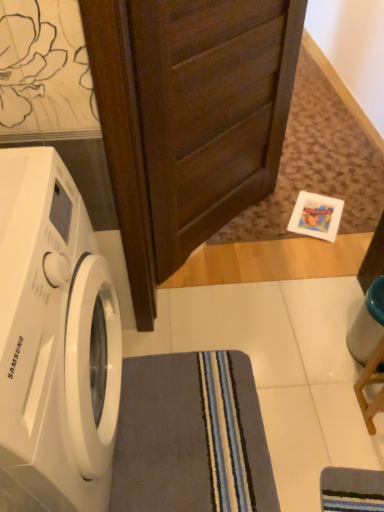
Find the location of `gray soft rug at lower center`. gray soft rug at lower center is located at coordinates (191, 436).

This screenshot has width=384, height=512. Identify the location of dark wood screen door at upper center. (210, 110).

Between gray soft rug at lower center and white glossy washing machine at left, which one appears on the left side from the viewer's perspective?

From the viewer's perspective, white glossy washing machine at left appears more on the left side.

Can you tell me how much gray soft rug at lower center and white glossy washing machine at left differ in facing direction?

The angular difference between gray soft rug at lower center and white glossy washing machine at left is 4.14 degrees.

Can you confirm if gray soft rug at lower center is taller than white glossy washing machine at left?

No, gray soft rug at lower center is not taller than white glossy washing machine at left.

Does point (194, 380) lie behind point (32, 282)?

Yes, point (194, 380) is farther from viewer.

Is gray soft rug at lower center inside or outside of dark wood screen door at upper center?

gray soft rug at lower center lies outside dark wood screen door at upper center.

Is point (155, 426) more distant than point (174, 122)?

Yes, it is.

How distant is gray soft rug at lower center from dark wood screen door at upper center?

A distance of 29.31 inches exists between gray soft rug at lower center and dark wood screen door at upper center.

Is the depth of gray soft rug at lower center greater than that of dark wood screen door at upper center?

Yes, gray soft rug at lower center is further from the camera.

At what (x,y) coordinates should I click in order to perform the action: click on bath towel beneath the white glossy washing machine at left (from a real-world perspective). Please return your answer as a coordinate pair (x, y). This screenshot has height=512, width=384. Looking at the image, I should click on (191, 436).

Is white glossy washing machine at left positioned with its back to gray soft rug at lower center?

No, white glossy washing machine at left's orientation is not away from gray soft rug at lower center.

Based on the photo, from a real-world perspective, is white glossy washing machine at left positioned above or below gray soft rug at lower center?

Clearly, from a real-world perspective, white glossy washing machine at left is above gray soft rug at lower center.

How many degrees apart are the facing directions of white glossy washing machine at left and gray soft rug at lower center?

4.14 degrees.

Does point (68, 492) lie behind point (194, 48)?

That is False.

Can you see white glossy washing machine at left touching dark wood screen door at upper center?

No, white glossy washing machine at left is not with dark wood screen door at upper center.

Which of these two, white glossy washing machine at left or dark wood screen door at upper center, is wider?

With larger width is white glossy washing machine at left.

Does white glossy washing machine at left have a greater height compared to dark wood screen door at upper center?

No.

From the image's perspective, is dark wood screen door at upper center on gray soft rug at lower center?

Correct, dark wood screen door at upper center appears higher than gray soft rug at lower center in the image.

Which of these two, dark wood screen door at upper center or gray soft rug at lower center, stands taller?

Standing taller between the two is dark wood screen door at upper center.

Is point (133, 27) closer to camera compared to point (158, 430)?

That is True.

Can you see dark wood screen door at upper center touching gray soft rug at lower center?

dark wood screen door at upper center and gray soft rug at lower center are clearly separated.

Would you consider dark wood screen door at upper center to be distant from white glossy washing machine at left?

dark wood screen door at upper center is actually quite close to white glossy washing machine at left.

Which object is further away from the camera, dark wood screen door at upper center or white glossy washing machine at left?

dark wood screen door at upper center is further away from the camera.

Can you tell me how much dark wood screen door at upper center and white glossy washing machine at left differ in facing direction?

There is a 43.6-degree angle between the facing directions of dark wood screen door at upper center and white glossy washing machine at left.

In terms of height, does dark wood screen door at upper center look taller or shorter compared to white glossy washing machine at left?

Considering their sizes, dark wood screen door at upper center has more height than white glossy washing machine at left.

What are the coordinates of `bath towel lying behind the white glossy washing machine at left` in the screenshot? It's located at tap(191, 436).

Find the location of a particular element. screen door on the right of gray soft rug at lower center is located at coordinates (210, 110).

Considering their positions, is dark wood screen door at upper center positioned further to gray soft rug at lower center than white glossy washing machine at left?

dark wood screen door at upper center.

Looking at the image, which one is located closer to gray soft rug at lower center, white glossy washing machine at left or dark wood screen door at upper center?

white glossy washing machine at left lies closer to gray soft rug at lower center than the other object.

Looking at this image, considering their positions, is dark wood screen door at upper center positioned closer to white glossy washing machine at left than gray soft rug at lower center?

Based on the image, gray soft rug at lower center appears to be nearer to white glossy washing machine at left.

Consider the image. Considering their positions, is gray soft rug at lower center positioned further to dark wood screen door at upper center than white glossy washing machine at left?

gray soft rug at lower center is further to dark wood screen door at upper center.

From the image, which object appears to be farther from white glossy washing machine at left, gray soft rug at lower center or dark wood screen door at upper center?

dark wood screen door at upper center lies further to white glossy washing machine at left than the other object.

Considering their positions, is white glossy washing machine at left positioned further to dark wood screen door at upper center than gray soft rug at lower center?

The object further to dark wood screen door at upper center is gray soft rug at lower center.

Locate an element on the screen. washing machine that lies between dark wood screen door at upper center and gray soft rug at lower center from top to bottom is located at coordinates (54, 342).